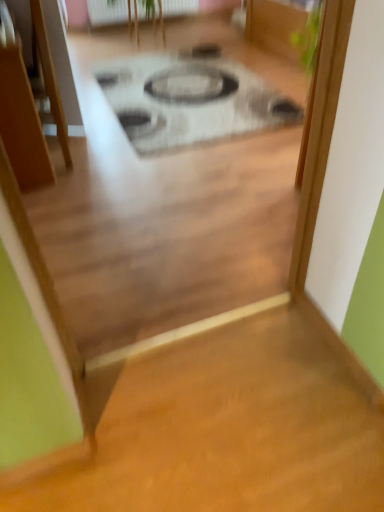
Where is `blank space situated above white textured rug at center (from a real-world perspective)`? The image size is (384, 512). blank space situated above white textured rug at center (from a real-world perspective) is located at coordinates (187, 104).